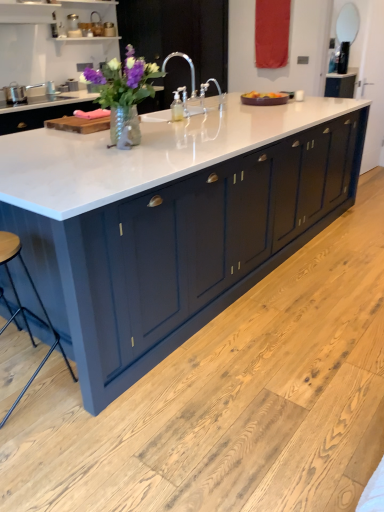
You are a GUI agent. You are given a task and a screenshot of the screen. Output one action in this format:
    pyautogui.click(x=<x>, y=<y>)
    Task: Click on the free space in front of white glossy sink at center
    The height and width of the screenshot is (512, 384).
    Given the screenshot: What is the action you would take?
    pyautogui.click(x=184, y=120)